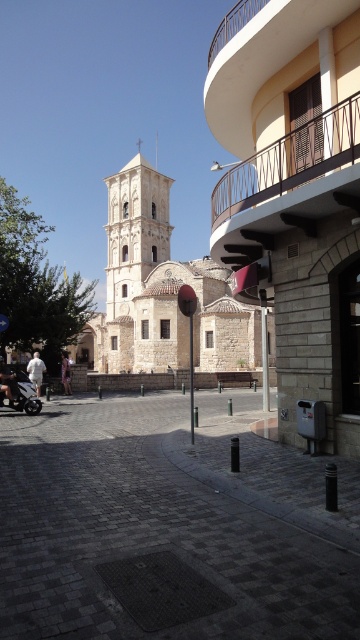
You are standing in the square in front of the historic stone church. You notice two points marked in the scene. The first point is at coordinates point (213,429), and the second point is at point (66,368). Which of these points is closer to your current position?

Point (213,429) is closer to the camera than point (66,368), so the first point is closer to your current position.

You are a photographer planning to capture the historic church in the background while including both the shiny chrome motorcycle at lower left and the light brown leather jacket at lower left in the frame. Since you want to focus on the church, which object should you position closer to the front of the scene to ensure the church remains the main focus?

Since the shiny chrome motorcycle at lower left occupies less space than the light brown leather jacket at lower left, positioning the motorcycle closer to the front would allow the larger jacket to be further back, keeping the church as the main focus in the background.